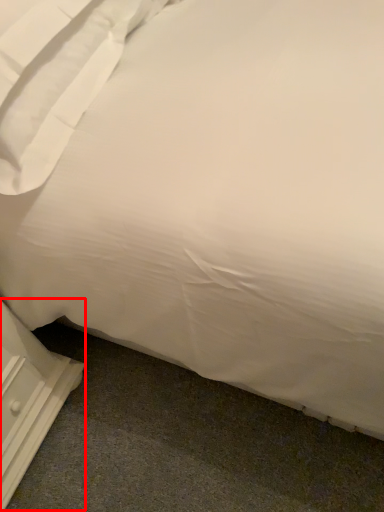
Question: From the image's perspective, what is the correct spatial relationship of dresser (annotated by the red box) in relation to pillow?

Choices:
 (A) below
 (B) above

Answer: (A)